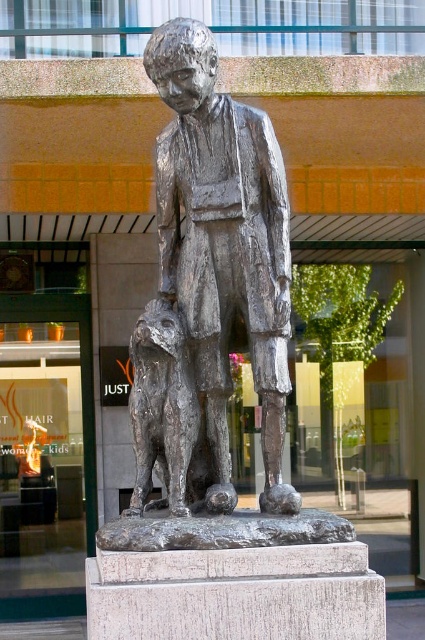
You are an art curator planning to move the polished silver statue at center and the shiny bronze dog at center to a new gallery layout. If you want to keep their relative positions the same as in the original image, which object should be placed to the right of the other?

The polished silver statue at center should be placed to the right of the shiny bronze dog at center to maintain their original positions.

You are an art conservator measuring the spacing between two statues for preservation purposes. The minimum recommended distance for preservation is 16 inches. Can you confirm if the spacing between the polished silver statue at center and the shiny bronze dog at center meets the requirement?

The distance between the polished silver statue at center and the shiny bronze dog at center is 17.11 inches, which exceeds the minimum recommended 16 inches for preservation. Therefore, the spacing meets the requirement.